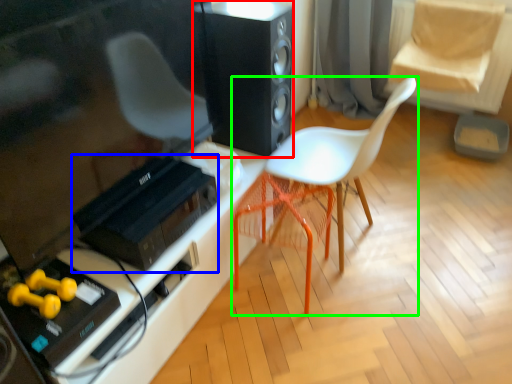
Question: Which is farther away from loudspeaker (highlighted by a red box)? stereo (highlighted by a blue box) or chair (highlighted by a green box)?

Choices:
 (A) stereo
 (B) chair

Answer: (A)